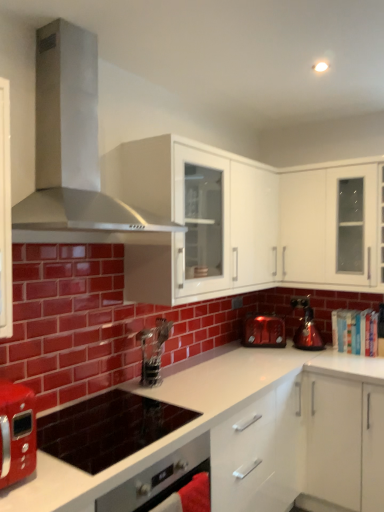
Question: In the image, is stainless steel range hood at upper left on the left side or the right side of white glossy cabinet at upper right, positioned as the first cabinetry in right-to-left order?

Choices:
 (A) left
 (B) right

Answer: (A)

Question: Considering the positions of stainless steel range hood at upper left and white glossy cabinet at upper right, positioned as the first cabinetry in right-to-left order, in the image, is stainless steel range hood at upper left taller or shorter than white glossy cabinet at upper right, positioned as the first cabinetry in right-to-left order,?

Choices:
 (A) short
 (B) tall

Answer: (A)

Question: Which object is positioned farthest from the white glossy countertop at center?

Choices:
 (A) metallic silver coffee machine at center
 (B) matte red toaster at center, which is the first kitchen appliance from left to right
 (C) shiny metallic kettle at right, the second kitchen appliance from the left
 (D) matte black cooktop at center
 (E) stainless steel range hood at upper left

Answer: (E)

Question: Which is farther from the metallic silver coffee machine at center?

Choices:
 (A) shiny metallic kettle at right, positioned as the 1th kitchen appliance in right-to-left order
 (B) stainless steel range hood at upper left
 (C) matte red toaster at center, which is the first kitchen appliance from left to right
 (D) matte black cooktop at center
 (E) white glossy cabinet at upper right, which appears as the second cabinetry when viewed from the left

Answer: (E)